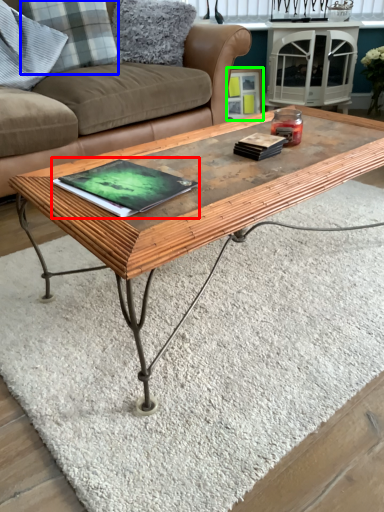
Question: Estimate the real-world distances between objects in this image. Which object is farther from book (highlighted by a red box), pillow (highlighted by a blue box) or picture frame (highlighted by a green box)?

Choices:
 (A) pillow
 (B) picture frame

Answer: (B)